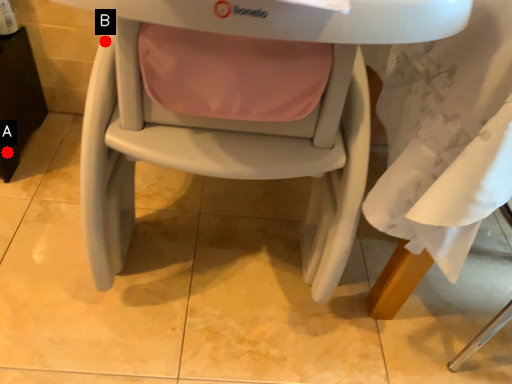
Question: Two points are circled on the image, labeled by A and B beside each circle. Which point is further to the camera?

Choices:
 (A) A is further
 (B) B is further

Answer: (A)